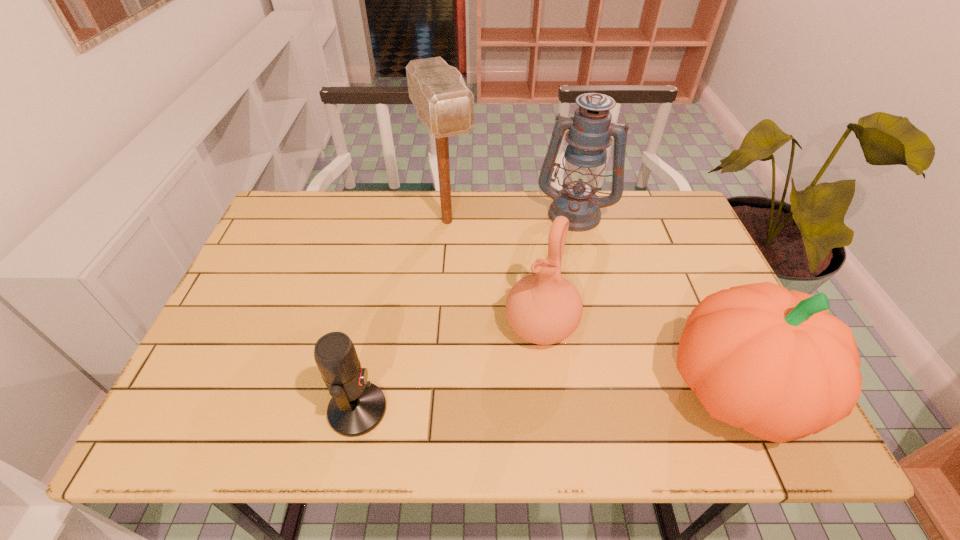
Where is `object that is positioned at the near right corner`? The width and height of the screenshot is (960, 540). object that is positioned at the near right corner is located at coordinates (759, 357).

You are a GUI agent. You are given a task and a screenshot of the screen. Output one action in this format:
    pyautogui.click(x=<x>, y=<y>)
    Task: Click on the blank area at the far edge
    Image resolution: width=960 pixels, height=540 pixels.
    Given the screenshot: What is the action you would take?
    pyautogui.click(x=433, y=207)

In the image, there is a desktop. At what (x,y) coordinates should I click in order to perform the action: click on vacant space at the near edge. Please return your answer as a coordinate pair (x, y). The height and width of the screenshot is (540, 960). Looking at the image, I should click on (500, 376).

The height and width of the screenshot is (540, 960). I want to click on free space at the left edge of the desktop, so click(256, 307).

You are a GUI agent. You are given a task and a screenshot of the screen. Output one action in this format:
    pyautogui.click(x=<x>, y=<y>)
    Task: Click on the vacant space at the right edge
    
    Given the screenshot: What is the action you would take?
    pyautogui.click(x=662, y=264)

In the image, there is a desktop. What are the coordinates of `vacant space at the far right corner` in the screenshot? It's located at (684, 220).

What are the coordinates of `vacant space that is in between the pumpkin and the second object from left to right` in the screenshot? It's located at (592, 306).

The height and width of the screenshot is (540, 960). Find the location of `vacant space that is in between the pottery and the second object from left to right`. vacant space that is in between the pottery and the second object from left to right is located at coordinates (494, 274).

At what (x,y) coordinates should I click in order to perform the action: click on vacant area that lies between the second object from left to right and the fourth shortest object. Please return your answer as a coordinate pair (x, y). The width and height of the screenshot is (960, 540). Looking at the image, I should click on (511, 217).

You are a GUI agent. You are given a task and a screenshot of the screen. Output one action in this format:
    pyautogui.click(x=<x>, y=<y>)
    Task: Click on the free space between the pottery and the pumpkin
    
    Given the screenshot: What is the action you would take?
    pyautogui.click(x=638, y=360)